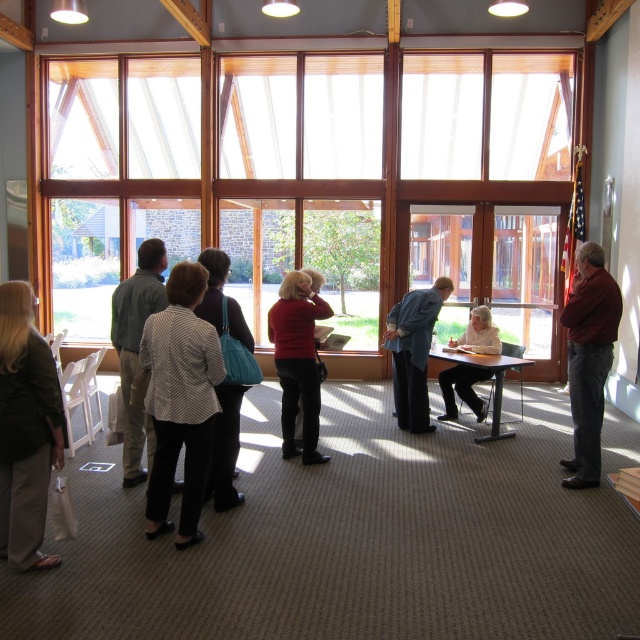
You are organizing a clothing display and need to place the dark green jacket at left and the green cotton shirt at center on a rack. Which clothing item requires a narrower hanger?

The dark green jacket at left requires a narrower hanger because it has a lesser width compared to the green cotton shirt at center.

Based on the photo, you are standing in the room depicted in the image. You want to look outside through the clear glass window at center. Where should you position yourself to have the best view?

To have the best view through the clear glass window at center, you should position yourself near the center of the room since the window is located at point 0.283 on the horizontal axis and 0.550 on the vertical axis.

You are standing in the room and want to see the view outside through the clear glass window at center. However, there is a person wearing a dark red shirt at right blocking your view. Can you look over their head to see the window?

The clear glass window at center is taller than dark red shirt at right, so yes, you can look over their head to see the window.